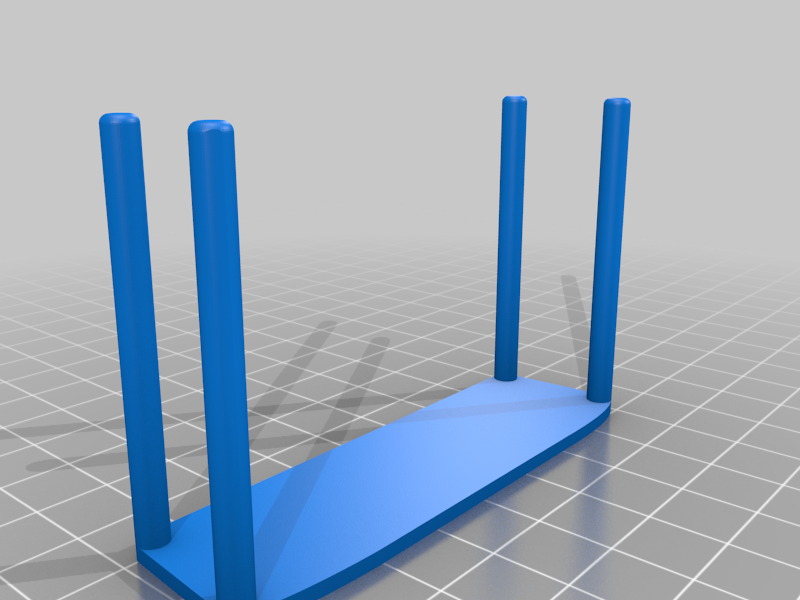
At what (x,y) coordinates should I click in order to perform the action: click on poster. Please return your answer as a coordinate pair (x, y). The image size is (800, 600). Looking at the image, I should click on (480, 463).